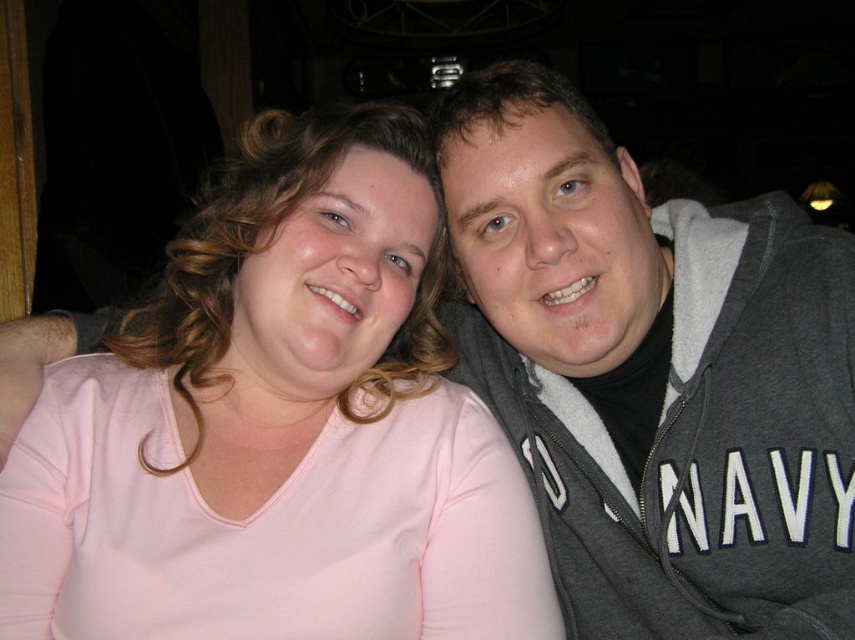
Question: Which of the following is the closest to the observer?

Choices:
 (A) pink fabric shirt at center
 (B) gray fleece hoodie at upper right

Answer: (A)

Question: Is pink fabric shirt at center wider than gray fleece hoodie at upper right?

Choices:
 (A) yes
 (B) no

Answer: (A)

Question: Can you confirm if pink fabric shirt at center is wider than gray fleece hoodie at upper right?

Choices:
 (A) no
 (B) yes

Answer: (B)

Question: Is pink fabric shirt at center further to the viewer compared to gray fleece hoodie at upper right?

Choices:
 (A) no
 (B) yes

Answer: (A)